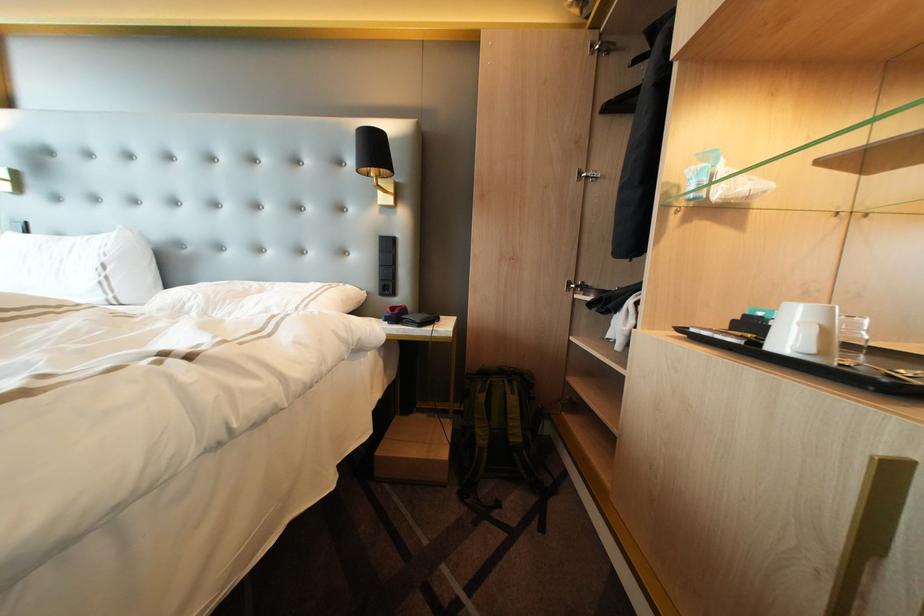
Identify the location of clear glass tumbler. (853, 339).